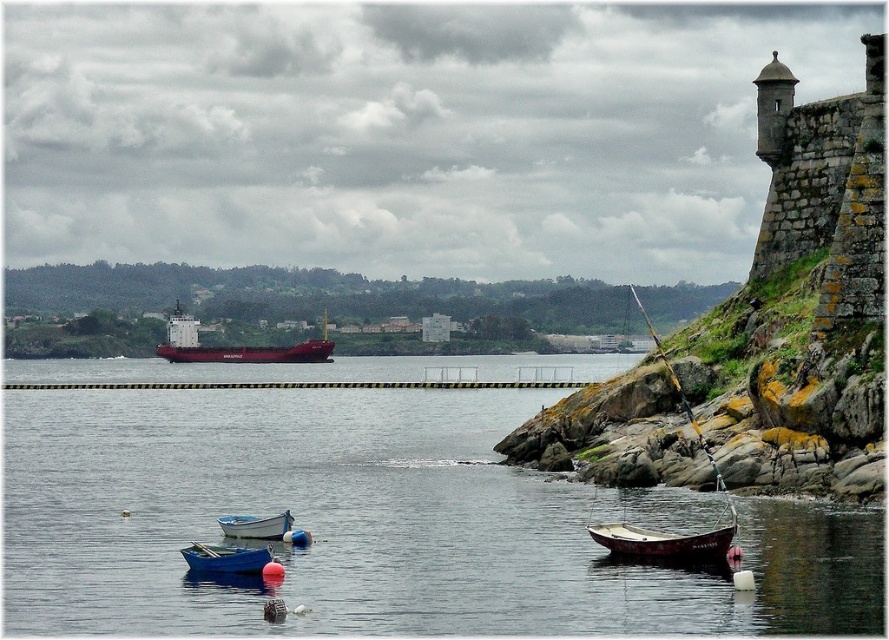
Question: Considering the relative positions of wooden sailboat at right and red matte cargo ship at center in the image provided, where is wooden sailboat at right located with respect to red matte cargo ship at center?

Choices:
 (A) above
 (B) below

Answer: (B)

Question: Does wooden sailboat at right have a larger size compared to red matte cargo ship at center?

Choices:
 (A) yes
 (B) no

Answer: (A)

Question: Does red matte cargo ship at center appear on the left side of blue matte boat at lower left?

Choices:
 (A) yes
 (B) no

Answer: (A)

Question: Considering the real-world distances, which object is farthest from the wooden sailboat at right?

Choices:
 (A) wooden boat at lower right
 (B) blue wooden boat at lower left
 (C) blue matte boat at lower left
 (D) red matte cargo ship at center

Answer: (D)

Question: Which point is farther to the camera?

Choices:
 (A) blue wooden boat at lower left
 (B) blue matte boat at lower left
 (C) wooden boat at lower right
 (D) red matte cargo ship at center

Answer: (D)

Question: Which point is farther from the camera taking this photo?

Choices:
 (A) (717, 531)
 (B) (226, 566)

Answer: (B)